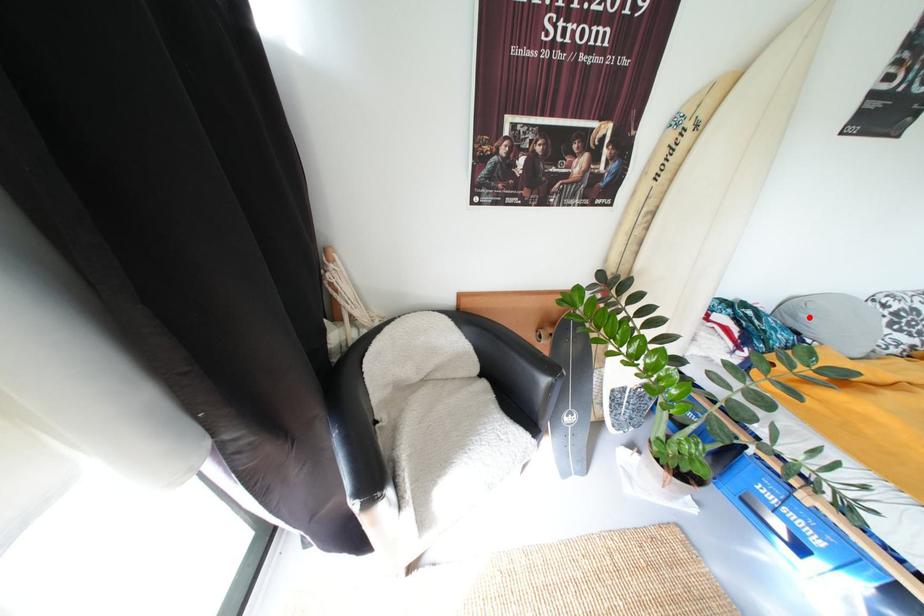
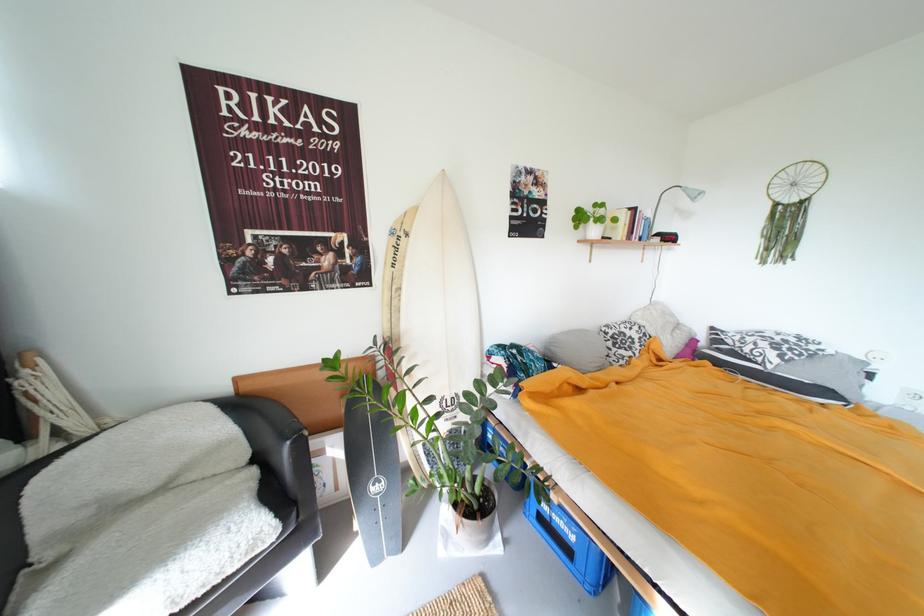
In the second image, find the point that corresponds to the highlighted location in the first image.

(560, 350)